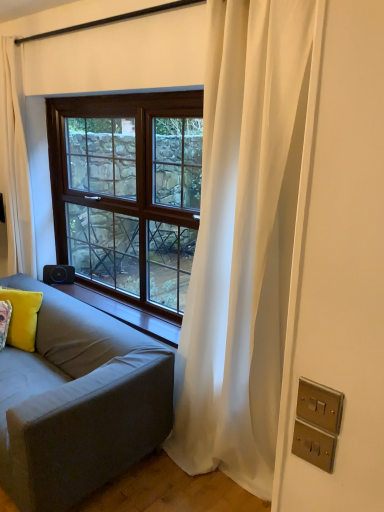
Question: Is point (36, 326) closer or farther from the camera than point (122, 393)?

Choices:
 (A) closer
 (B) farther

Answer: (B)

Question: Is yellow velvet pillow at lower left in front of or behind gray fabric couch at left in the image?

Choices:
 (A) front
 (B) behind

Answer: (B)

Question: Based on their relative distances, which object is nearer to the satin brass switchplate at lower right, the 1th electric outlet from the top?

Choices:
 (A) brown wood window sill at lower left
 (B) black plastic speaker at lower left
 (C) gray fabric couch at left
 (D) brown wooden window at center
 (E) yellow velvet pillow at lower left

Answer: (C)

Question: Based on their relative distances, which object is farther from the gray fabric couch at left?

Choices:
 (A) brown wood window sill at lower left
 (B) white sheer curtain at left, the second curtain when ordered from right to left
 (C) black plastic speaker at lower left
 (D) satin gold switchplate at lower right, which is the 1th electric outlet from bottom to top
 (E) white sheer curtain at right, positioned as the 1th curtain in front-to-back order

Answer: (D)